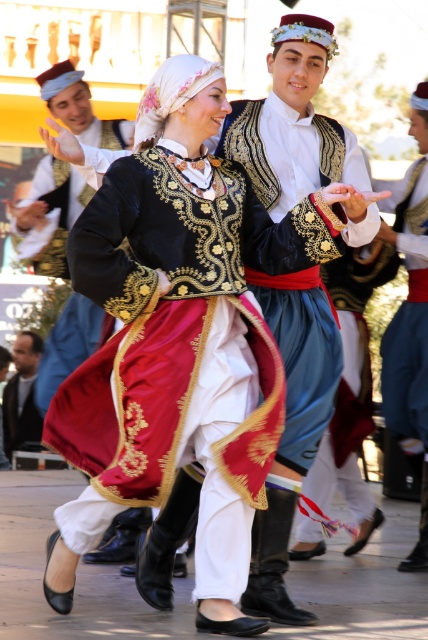
Question: Which object is the closest to the velvet red skirt at center?

Choices:
 (A) matte black vest at center
 (B) shiny blue fabric at center

Answer: (B)

Question: Does shiny blue fabric at center appear over dark blue fabric jacket at lower left?

Choices:
 (A) yes
 (B) no

Answer: (A)

Question: Which point is farther to the camera?

Choices:
 (A) (50, 205)
 (B) (27, 400)

Answer: (B)

Question: Does velvet red skirt at center appear over matte black vest at center?

Choices:
 (A) no
 (B) yes

Answer: (A)

Question: Which of the following is the farthest from the observer?

Choices:
 (A) (240, 616)
 (B) (112, 141)
 (C) (341, 234)
 (D) (26, 442)

Answer: (D)

Question: Does velvet red skirt at center have a smaller size compared to dark blue fabric jacket at lower left?

Choices:
 (A) no
 (B) yes

Answer: (A)